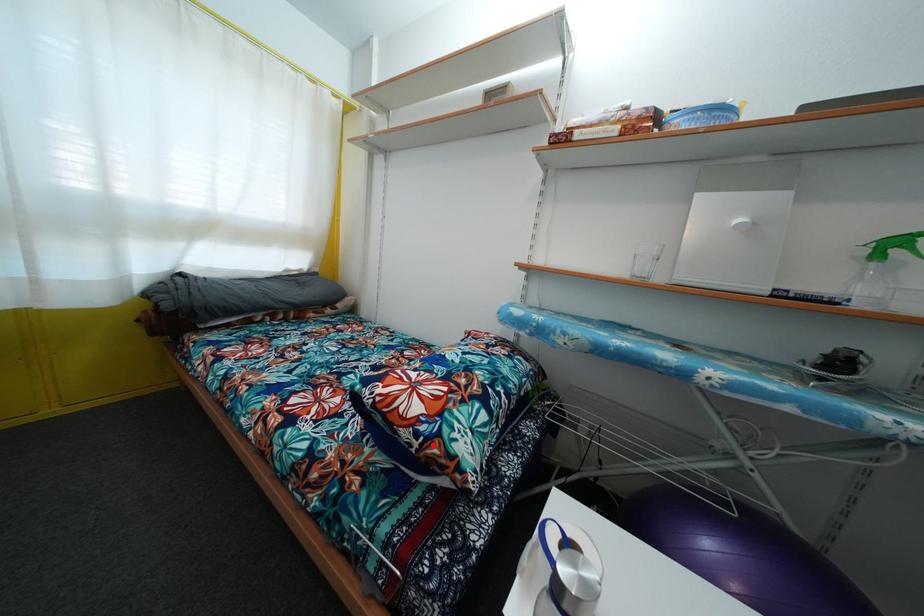
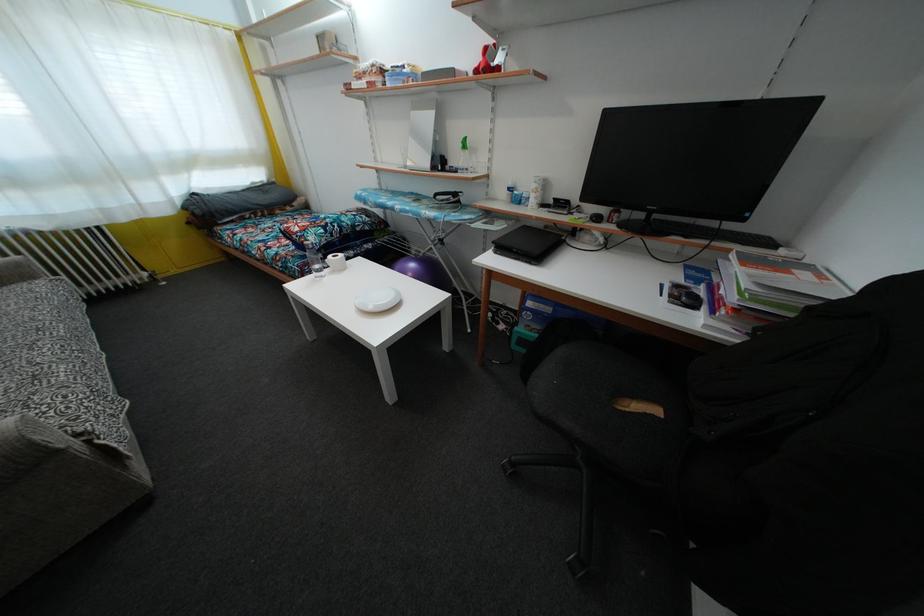
Question: I am providing you with two images of the same scene from different viewpoints. Image1 has a red point marked. In image2, the corresponding 3D location appears at what relative position? Reply with the corresponding letter.

Choices:
 (A) Closer
 (B) Farther

Answer: (A)